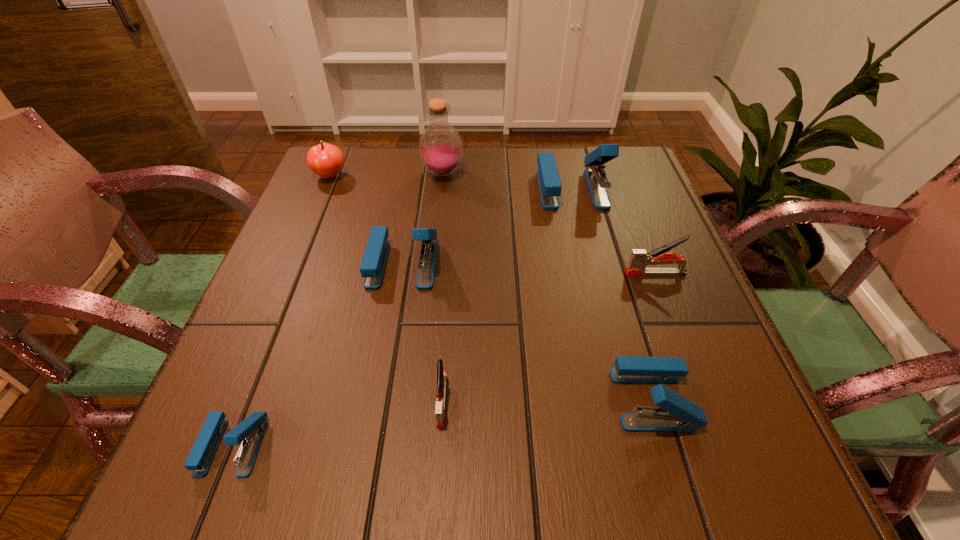
This screenshot has height=540, width=960. I want to click on the left gray stapler, so click(441, 375).

Locate an element on the screen. The height and width of the screenshot is (540, 960). the smaller gray stapler is located at coordinates (441, 375).

At what (x,y) coordinates should I click in order to perform the action: click on the leftmost stapler. Please return your answer as a coordinate pair (x, y). The width and height of the screenshot is (960, 540). Looking at the image, I should click on (x=251, y=431).

Locate an element on the screen. The height and width of the screenshot is (540, 960). the smallest blue stapler is located at coordinates (251, 431).

This screenshot has width=960, height=540. What are the coordinates of `vacant space located on the front of the bottle` in the screenshot? It's located at (x=430, y=292).

Locate an element on the screen. This screenshot has height=540, width=960. vacant space located 0.270m on the front of the farthest blue stapler is located at coordinates (598, 296).

What are the coordinates of `free space located on the back of the fifth stapler from right to left` in the screenshot? It's located at (416, 187).

Image resolution: width=960 pixels, height=540 pixels. I want to click on vacant position located on the handle side of the right gray stapler, so click(468, 273).

Find the location of a particular element. free space located 0.230m on the handle side of the right gray stapler is located at coordinates (513, 273).

Where is `vacant space located 0.330m on the handle side of the right gray stapler`? vacant space located 0.330m on the handle side of the right gray stapler is located at coordinates pos(464,273).